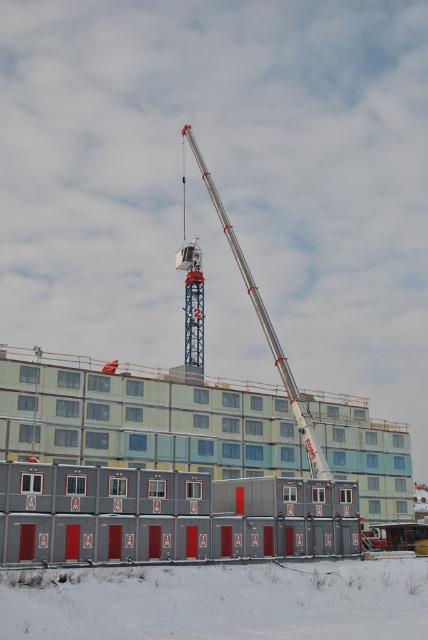
You are a construction worker who needs to place a heavy equipment box on the ground. The box is too heavy to lift, so you must use the crane to lower it. Where should you direct the crane operator to place the box so it lands on the white powdery snow at lower center without hitting the silver metallic crane at center?

The crane operator should lower the box onto the white powdery snow at lower center since it is positioned under the silver metallic crane at center, ensuring the box lands safely on the snow without colliding with the crane.

You are a construction worker trying to determine if the white powdery snow at lower center can fully cover the silver metallic crane at center if it were to spread out. Based on their widths, can the snow cover the crane?

The white powdery snow at lower center is wider than the silver metallic crane at center, so if the snow were to spread out evenly, it could potentially cover the crane completely based on width measurements.